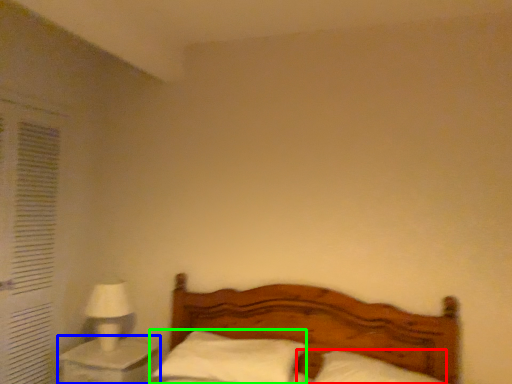
Question: Which object is positioned closest to pillow (highlighted by a red box)? Select from nightstand (highlighted by a blue box) and pillow (highlighted by a green box).

Choices:
 (A) nightstand
 (B) pillow

Answer: (B)